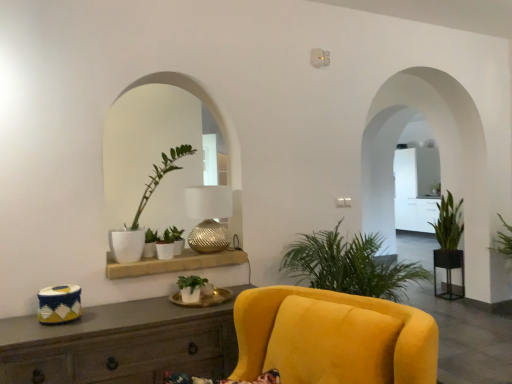
Where is `vacant space situated on the left part of green matte plant at center, the 3th houseplant viewed from the front`? This screenshot has height=384, width=512. vacant space situated on the left part of green matte plant at center, the 3th houseplant viewed from the front is located at coordinates (141, 261).